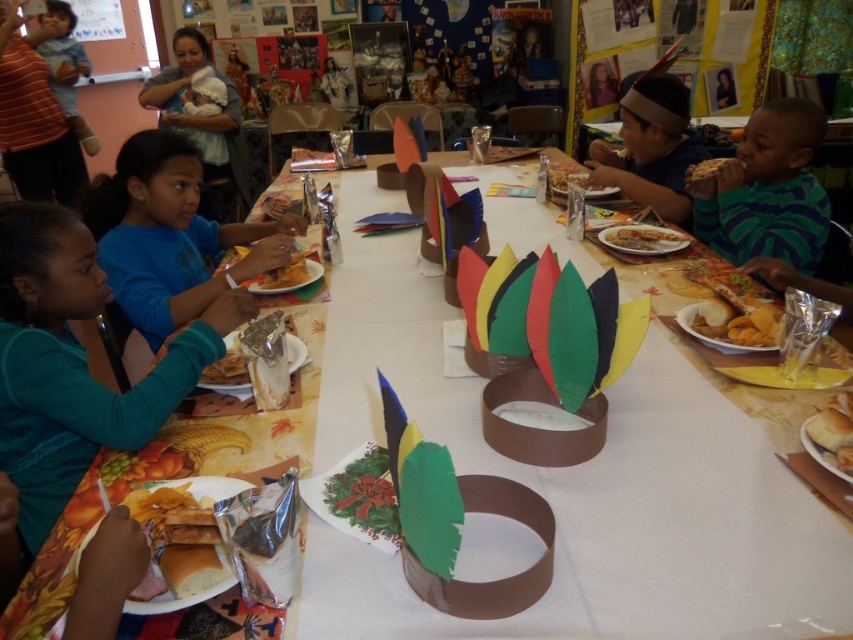
Can you confirm if brown paper plate at center is positioned to the right of matte brown paper plate at upper center?

Yes, brown paper plate at center is to the right of matte brown paper plate at upper center.

Can you confirm if brown paper plate at center is positioned above matte brown paper plate at upper center?

Incorrect, brown paper plate at center is not positioned above matte brown paper plate at upper center.

Locate an element on the screen. The width and height of the screenshot is (853, 640). brown paper plate at center is located at coordinates (643, 237).

At what (x,y) coordinates should I click in order to perform the action: click on brown paper plate at center. Please return your answer as a coordinate pair (x, y). The height and width of the screenshot is (640, 853). Looking at the image, I should click on (x=643, y=237).

Can you confirm if blue matte shirt at left is bigger than matte brown paper plate at upper center?

Yes.

Is blue matte shirt at left closer to the viewer compared to matte brown paper plate at upper center?

Yes.

Locate an element on the screen. blue matte shirt at left is located at coordinates (170, 236).

Looking at this image, is white paper plate at lower left taller than yellow matte chips at center?

Correct, white paper plate at lower left is much taller as yellow matte chips at center.

Describe the element at coordinates (207, 486) in the screenshot. I see `white paper plate at lower left` at that location.

This screenshot has width=853, height=640. What are the coordinates of `white paper plate at lower left` in the screenshot? It's located at (207, 486).